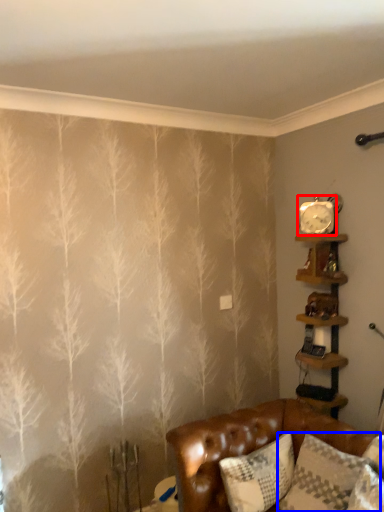
Question: Which of the following is the closest to the observer, clock (highlighted by a red box) or pillow (highlighted by a blue box)?

Choices:
 (A) clock
 (B) pillow

Answer: (B)